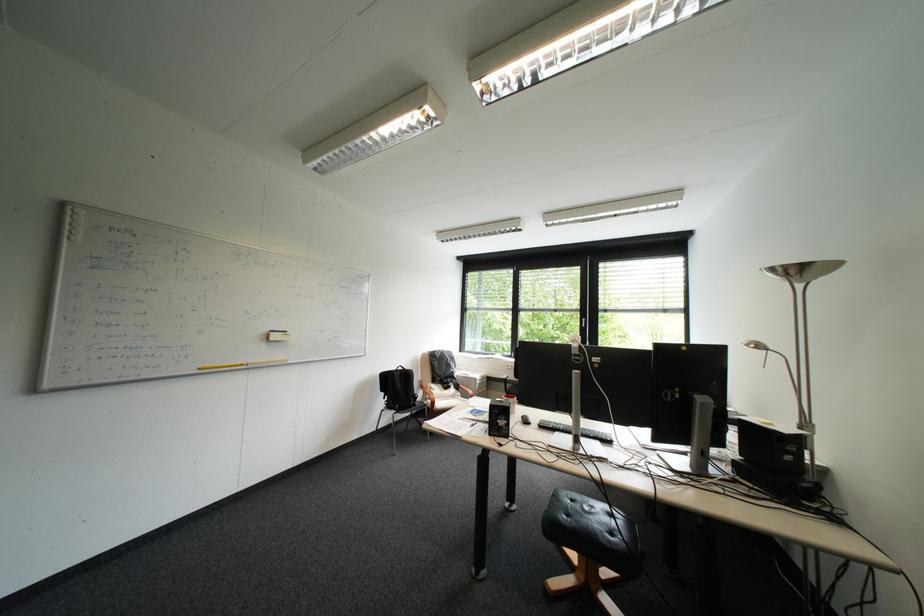
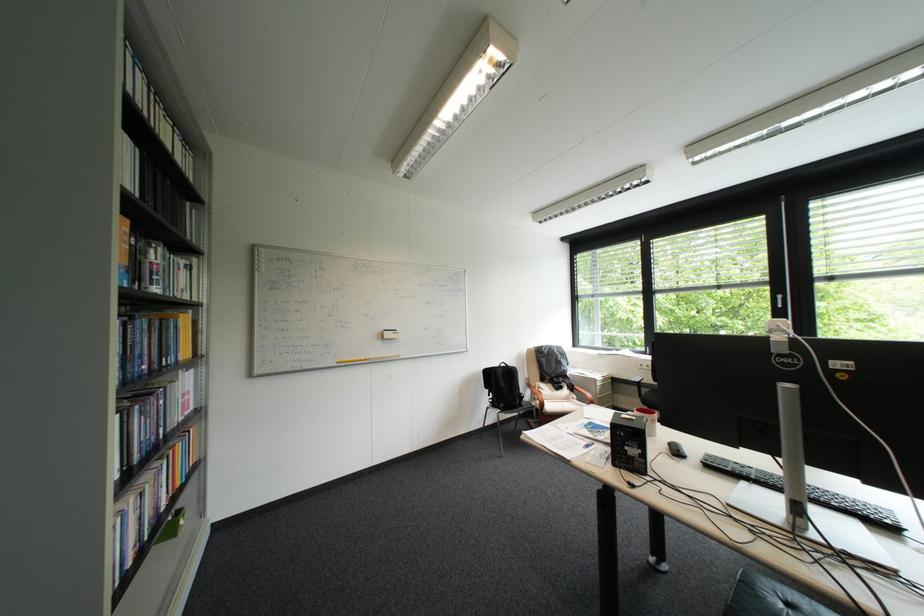
In the second image, find the point that corresponds to [213,367] in the first image.

(350, 361)